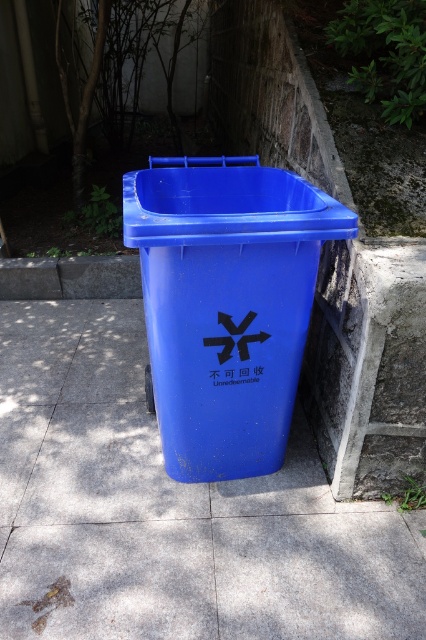
Does blue plastic trash can at center have a greater width compared to matte plastic trash can at center?

Indeed, blue plastic trash can at center has a greater width compared to matte plastic trash can at center.

Is point (259, 600) positioned in front of point (279, 355)?

Yes, point (259, 600) is closer to viewer.

This screenshot has height=640, width=426. What are the coordinates of `blue plastic trash can at center` in the screenshot? It's located at (170, 509).